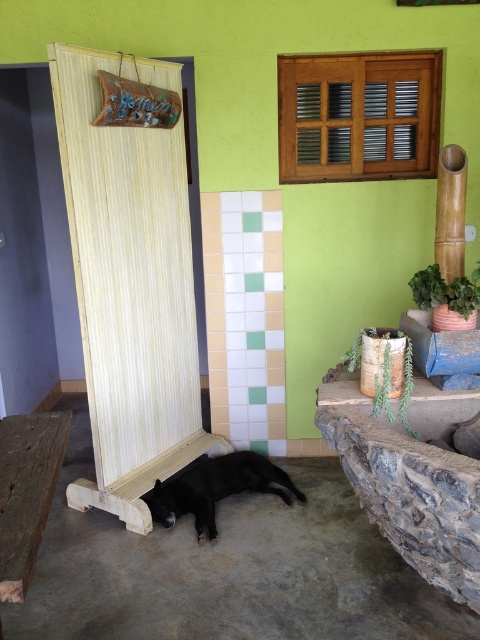
Between wooden screen at left and rustic wooden bench at lower left, which one has less height?

Standing shorter between the two is rustic wooden bench at lower left.

Is wooden screen at left above rustic wooden bench at lower left?

Yes, wooden screen at left is above rustic wooden bench at lower left.

Is point (91, 52) farther from viewer compared to point (33, 493)?

Yes.

Locate an element on the screen. The width and height of the screenshot is (480, 640). wooden screen at left is located at coordinates (130, 285).

Can you confirm if rustic wooden bench at lower left is thinner than black matte dog at lower center?

Yes, rustic wooden bench at lower left is thinner than black matte dog at lower center.

Is the position of rustic wooden bench at lower left less distant than that of black matte dog at lower center?

Yes, rustic wooden bench at lower left is closer to the viewer.

Who is more forward, (x=45, y=449) or (x=212, y=524)?

Point (x=45, y=449) is in front.

Locate an element on the screen. The image size is (480, 640). rustic wooden bench at lower left is located at coordinates (26, 492).

Does wooden screen at left appear under black matte dog at lower center?

Actually, wooden screen at left is above black matte dog at lower center.

Locate an element on the screen. This screenshot has height=640, width=480. wooden screen at left is located at coordinates click(x=130, y=285).

Image resolution: width=480 pixels, height=640 pixels. I want to click on wooden screen at left, so click(130, 285).